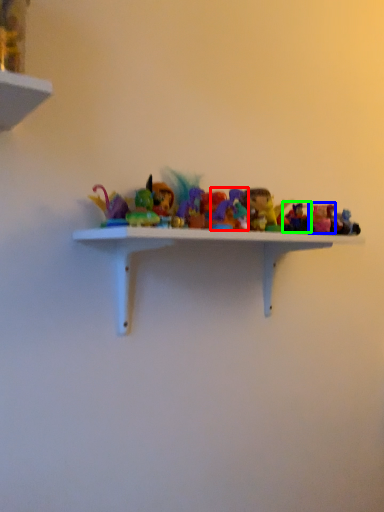
Question: Which object is the closest to the toy (highlighted by a red box)? Choose among these: toy (highlighted by a blue box) or toy (highlighted by a green box).

Choices:
 (A) toy
 (B) toy

Answer: (B)